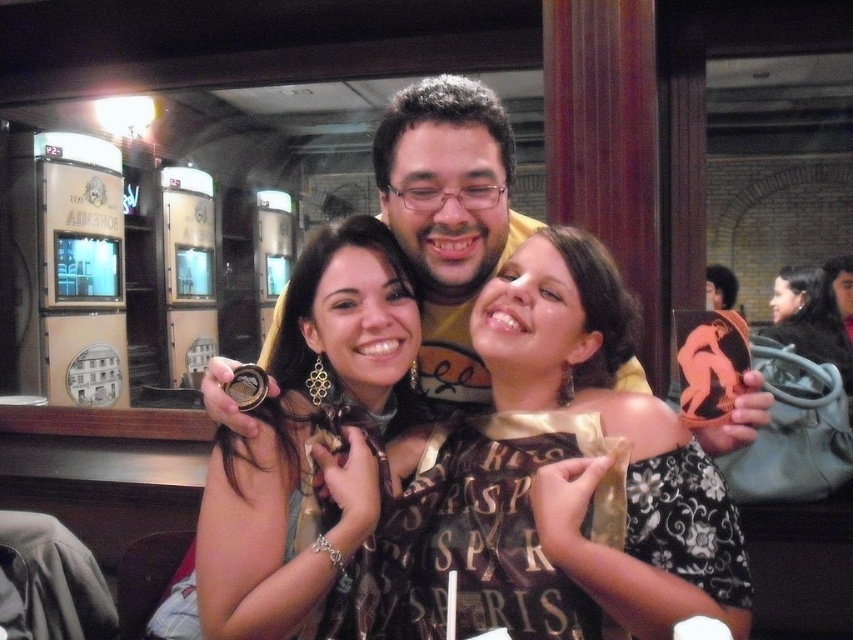
Is point (454, 388) farther from viewer compared to point (850, 374)?

No, it is in front of (850, 374).

Can you confirm if matte gold coin at center is positioned below matte black purse at upper right?

Actually, matte gold coin at center is above matte black purse at upper right.

The width and height of the screenshot is (853, 640). Describe the element at coordinates (448, 212) in the screenshot. I see `matte gold coin at center` at that location.

Where is `matte gold coin at center`? matte gold coin at center is located at coordinates (448, 212).

Does gold chain necklace at center appear on the left side of matte black purse at upper right?

Yes, gold chain necklace at center is to the left of matte black purse at upper right.

Can you confirm if gold chain necklace at center is positioned above matte black purse at upper right?

Actually, gold chain necklace at center is below matte black purse at upper right.

Measure the distance between gold chain necklace at center and camera.

The distance of gold chain necklace at center from camera is 1.04 meters.

This screenshot has width=853, height=640. In order to click on gold chain necklace at center in this screenshot , I will do `click(306, 435)`.

Can you confirm if shiny gold necklace at center is wider than matte black purse at upper right?

Yes.

At what (x,y) coordinates should I click in order to perform the action: click on shiny gold necklace at center. Please return your answer as a coordinate pair (x, y). Image resolution: width=853 pixels, height=640 pixels. Looking at the image, I should click on (552, 484).